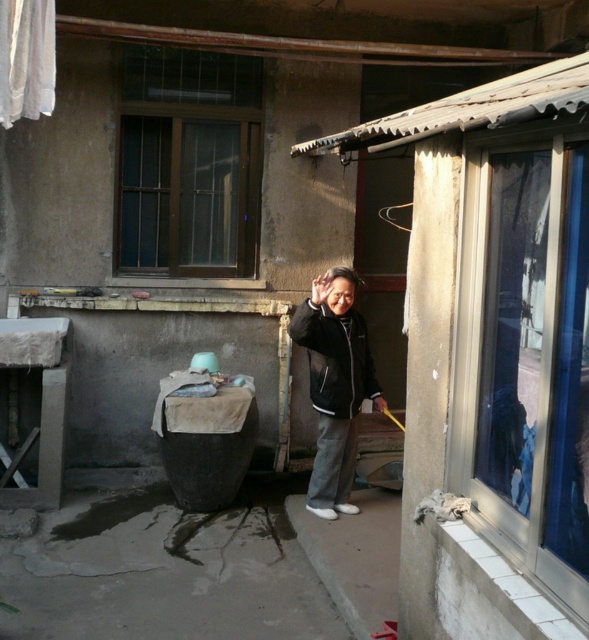
You are a delivery person trying to locate the correct apartment. You see a transparent glass window at right and a dark brown wooden window at upper left. Which window is positioned to the right of the other?

The transparent glass window at right is positioned on the right side of dark brown wooden window at upper left.

You are a delivery person trying to see inside a house through the windows. Which window, the transparent glass window at right or the dark brown wooden window at upper left, allows you to see more clearly?

The transparent glass window at right allows you to see more clearly because it is made of clear glass, while the dark brown wooden window at upper left may have wooden panes or frames that obstruct the view.